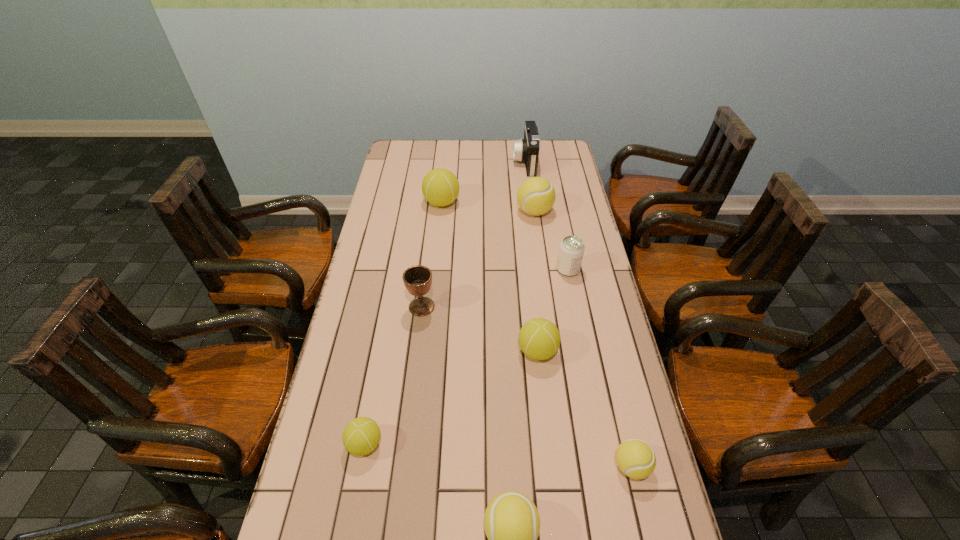
Image resolution: width=960 pixels, height=540 pixels. Find the location of `tennis ball that is the second closest one to the second green tennis ball from right to left`. tennis ball that is the second closest one to the second green tennis ball from right to left is located at coordinates (539, 339).

Locate an element on the screen. yellow tennis ball that is the closest to the leftmost yellow tennis ball is located at coordinates (636, 459).

Select which yellow tennis ball appears as the third closest to the camcorder. Please provide its 2D coordinates. Your answer should be formatted as a tuple, i.e. [(x, y)], where the tuple contains the x and y coordinates of a point satisfying the conditions above.

[(511, 522)]

I want to click on green tennis ball object that ranks as the third closest to the nearest yellow tennis ball, so click(440, 187).

Image resolution: width=960 pixels, height=540 pixels. Identify the location of green tennis ball that is the second closest to the biggest green tennis ball. (361, 436).

Find the location of a particular element. The width and height of the screenshot is (960, 540). free spot that satisfies the following two spatial constraints: 1. on the back side of the farthest yellow tennis ball; 2. on the left side of the leftmost green tennis ball is located at coordinates (408, 212).

The image size is (960, 540). I want to click on free space that satisfies the following two spatial constraints: 1. on the lens of the farthest object; 2. on the front side of the chalice, so click(544, 307).